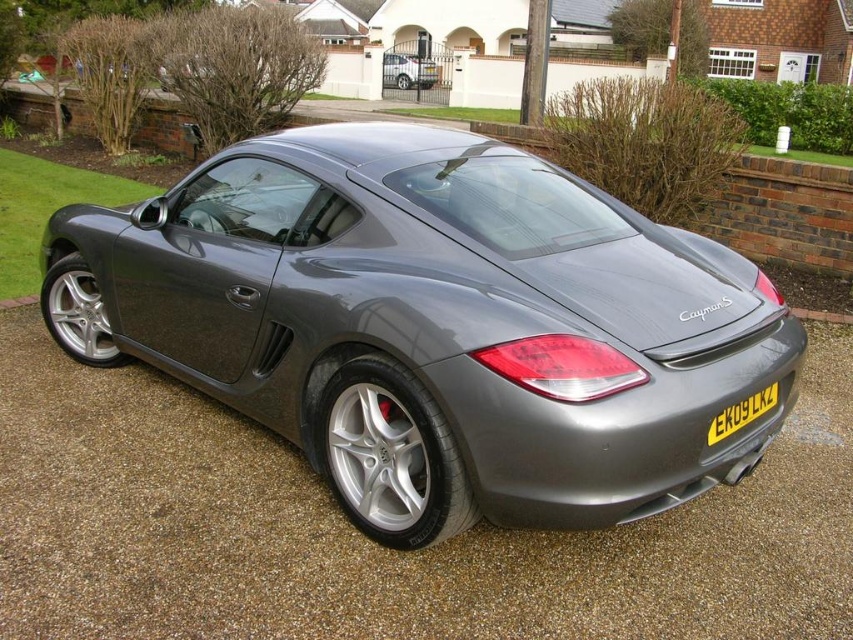
Who is positioned more to the left, yellow metallic license plate at rear or satin silver car at center?

Positioned to the left is satin silver car at center.

Can you confirm if yellow metallic license plate at rear is positioned to the left of satin silver car at center?

In fact, yellow metallic license plate at rear is to the right of satin silver car at center.

Where is `yellow metallic license plate at rear`? This screenshot has height=640, width=853. yellow metallic license plate at rear is located at coordinates (741, 413).

Does satin metallic car at center appear over yellow metallic license plate at rear?

Indeed, satin metallic car at center is positioned over yellow metallic license plate at rear.

Between satin metallic car at center and yellow metallic license plate at rear, which one is positioned higher?

satin metallic car at center is above.

Identify the location of satin metallic car at center. This screenshot has height=640, width=853. (434, 324).

Is metallic gray car at center thinner than yellow metallic license plate at rear?

No.

The image size is (853, 640). What do you see at coordinates (370, 541) in the screenshot? I see `metallic gray car at center` at bounding box center [370, 541].

Where is `metallic gray car at center`? Image resolution: width=853 pixels, height=640 pixels. metallic gray car at center is located at coordinates point(370,541).